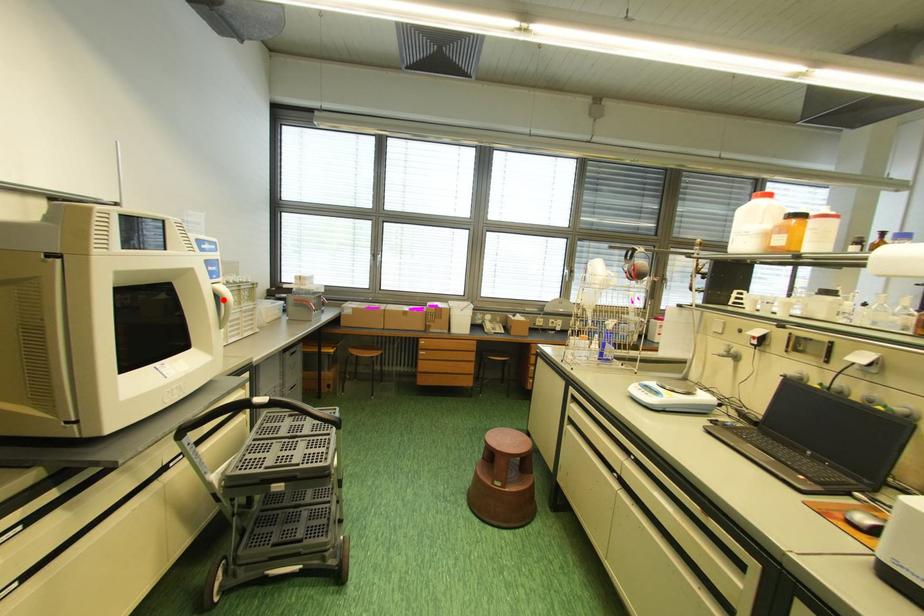
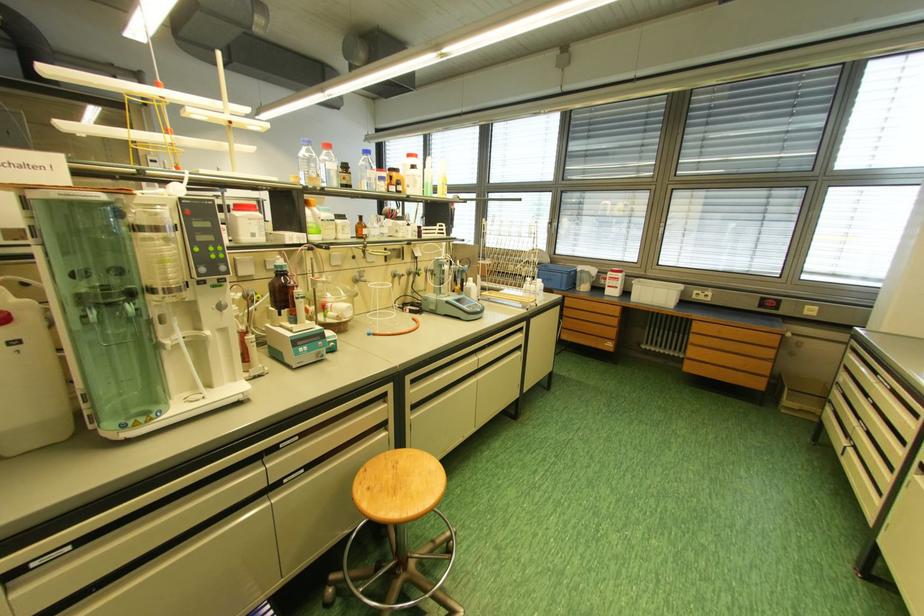
Question: I am providing you with two images of the same scene from different viewpoints. A red point is marked on the first image. Can you still see the location of the red point in image 2?

Choices:
 (A) Yes
 (B) No

Answer: (B)